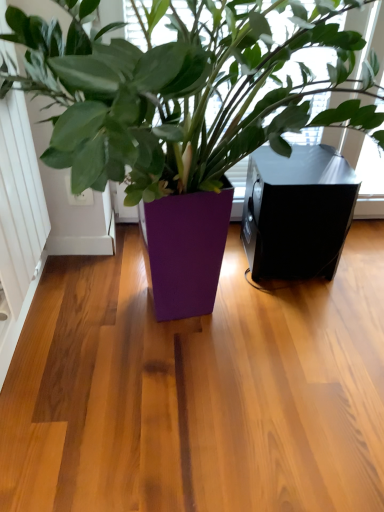
Question: Can you confirm if purple glossy planter at center is smaller than white matte screen door at left?

Choices:
 (A) yes
 (B) no

Answer: (B)

Question: Considering the relative sizes of purple glossy planter at center and white matte screen door at left in the image provided, is purple glossy planter at center thinner than white matte screen door at left?

Choices:
 (A) yes
 (B) no

Answer: (B)

Question: Could you tell me if purple glossy planter at center is turned towards white matte screen door at left?

Choices:
 (A) no
 (B) yes

Answer: (A)

Question: Is purple glossy planter at center to the right of white matte screen door at left from the viewer's perspective?

Choices:
 (A) no
 (B) yes

Answer: (B)

Question: Is white matte screen door at left located within purple glossy planter at center?

Choices:
 (A) yes
 (B) no

Answer: (B)

Question: Can you confirm if purple glossy planter at center is taller than white matte screen door at left?

Choices:
 (A) yes
 (B) no

Answer: (A)

Question: Does purple glossy planter at center have a lesser height compared to black matte speaker at right?

Choices:
 (A) yes
 (B) no

Answer: (B)

Question: Can you confirm if purple glossy planter at center is positioned to the right of black matte speaker at right?

Choices:
 (A) yes
 (B) no

Answer: (B)

Question: Is purple glossy planter at center taller than black matte speaker at right?

Choices:
 (A) yes
 (B) no

Answer: (A)

Question: Is purple glossy planter at center turned away from black matte speaker at right?

Choices:
 (A) no
 (B) yes

Answer: (B)

Question: Can you confirm if purple glossy planter at center is bigger than black matte speaker at right?

Choices:
 (A) no
 (B) yes

Answer: (B)

Question: Is purple glossy planter at center aimed at black matte speaker at right?

Choices:
 (A) yes
 (B) no

Answer: (B)

Question: Considering the relative sizes of white matte screen door at left and purple glossy planter at center in the image provided, is white matte screen door at left smaller than purple glossy planter at center?

Choices:
 (A) yes
 (B) no

Answer: (A)